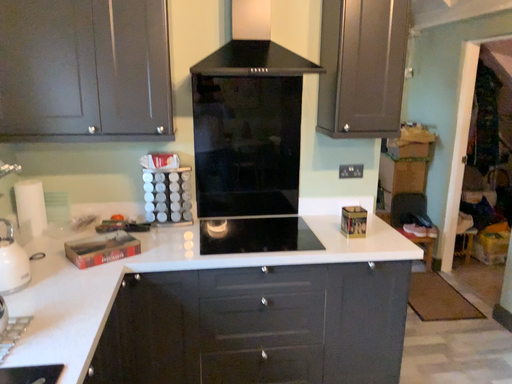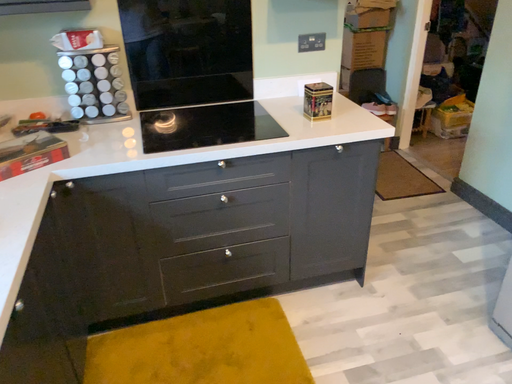
Question: How did the camera likely rotate when shooting the video?

Choices:
 (A) rotated left
 (B) rotated right

Answer: (B)